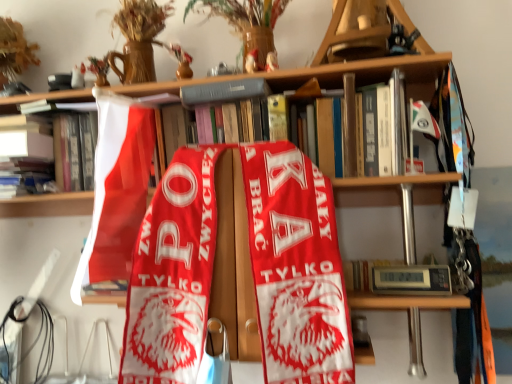
At what (x,y) coordinates should I click in order to perform the action: click on hardcover book at upper center, acting as the 2th book starting from the right. Please return your answer as a coordinate pair (x, y). Looking at the image, I should click on [x=159, y=86].

You are a GUI agent. You are given a task and a screenshot of the screen. Output one action in this format:
    pyautogui.click(x=<x>, y=<y>)
    Task: Click on the hardcover book at upper center, the first book in the right-to-left sequence
    
    Given the screenshot: What is the action you would take?
    pyautogui.click(x=224, y=91)

Identify the location of matte white book at upper left, the third book when ordered from right to left. The width and height of the screenshot is (512, 384). (46, 154).

Between matte white book at upper left, the third book when ordered from right to left, and hardcover book at upper center, acting as the 2th book starting from the right, which one appears on the right side from the viewer's perspective?

hardcover book at upper center, acting as the 2th book starting from the right.

From the image's perspective, is matte white book at upper left, the third book when ordered from right to left, located beneath hardcover book at upper center, which is the second book from left to right?

Yes, from the image's perspective, matte white book at upper left, the third book when ordered from right to left, is beneath hardcover book at upper center, which is the second book from left to right.

Who is bigger, matte white book at upper left, which appears as the 1th book when viewed from the left, or hardcover book at upper center, which is the second book from left to right?

hardcover book at upper center, which is the second book from left to right, is bigger.

Which is in front, matte white book at upper left, the third book when ordered from right to left, or hardcover book at upper center, acting as the 2th book starting from the right?

hardcover book at upper center, acting as the 2th book starting from the right.

Is hardcover book at upper center, acting as the 2th book starting from the right, surrounding red fabric scarf at center?

No, hardcover book at upper center, acting as the 2th book starting from the right, does not contain red fabric scarf at center.

Is hardcover book at upper center, acting as the 2th book starting from the right, facing away from red fabric scarf at center?

No, hardcover book at upper center, acting as the 2th book starting from the right, is not facing the opposite direction of red fabric scarf at center.

Which object is thinner, hardcover book at upper center, acting as the 2th book starting from the right, or red fabric scarf at center?

red fabric scarf at center is thinner.

Is point (87, 91) behind point (335, 339)?

That is True.

From a real-world perspective, which object rests below the other?

red fabric scarf at center.

Considering the positions of objects red fabric scarf at center and matte white book at upper left, the third book when ordered from right to left, in the image provided, who is more to the right, red fabric scarf at center or matte white book at upper left, the third book when ordered from right to left,?

red fabric scarf at center.

Locate an element on the screen. the 3rd book counting from the left side of the red fabric scarf at center is located at coordinates (46, 154).

From the image's perspective, who appears lower, matte white book at upper left, the third book when ordered from right to left, or hardcover book at upper center, the first book in the right-to-left sequence?

matte white book at upper left, the third book when ordered from right to left, from the image's perspective.

Is matte white book at upper left, which appears as the 1th book when viewed from the left, far from hardcover book at upper center, acting as the third book starting from the left?

No, matte white book at upper left, which appears as the 1th book when viewed from the left, is not far away from hardcover book at upper center, acting as the third book starting from the left.

Between matte white book at upper left, the third book when ordered from right to left, and hardcover book at upper center, acting as the third book starting from the left, which one has larger size?

matte white book at upper left, the third book when ordered from right to left, is bigger.

In the scene shown: From a real-world perspective, is matte white book at upper left, which appears as the 1th book when viewed from the left, located higher than hardcover book at upper center, acting as the third book starting from the left?

No, from a real-world perspective, matte white book at upper left, which appears as the 1th book when viewed from the left, is not on top of hardcover book at upper center, acting as the third book starting from the left.

From the picture: From a real-world perspective, is red fabric scarf at center above or below hardcover book at upper center, acting as the third book starting from the left?

From a real-world perspective, red fabric scarf at center is physically below hardcover book at upper center, acting as the third book starting from the left.

Between point (165, 316) and point (197, 97), which one is positioned in front?

The point (165, 316) is closer to the camera.

From the image's perspective, does red fabric scarf at center appear higher than hardcover book at upper center, acting as the third book starting from the left?

Incorrect, from the image's perspective, red fabric scarf at center is lower than hardcover book at upper center, acting as the third book starting from the left.

Is red fabric scarf at center far away from hardcover book at upper center, the first book in the right-to-left sequence?

No, red fabric scarf at center is not far away from hardcover book at upper center, the first book in the right-to-left sequence.

Is hardcover book at upper center, which is the second book from left to right, bigger than hardcover book at upper center, acting as the third book starting from the left?

Yes, hardcover book at upper center, which is the second book from left to right, is bigger than hardcover book at upper center, acting as the third book starting from the left.

From the picture: Can you confirm if hardcover book at upper center, acting as the 2th book starting from the right, is taller than hardcover book at upper center, acting as the third book starting from the left?

Correct, hardcover book at upper center, acting as the 2th book starting from the right, is much taller as hardcover book at upper center, acting as the third book starting from the left.

Between hardcover book at upper center, acting as the 2th book starting from the right, and hardcover book at upper center, acting as the third book starting from the left, which one appears on the left side from the viewer's perspective?

From the viewer's perspective, hardcover book at upper center, acting as the 2th book starting from the right, appears more on the left side.

Looking at this image, from a real-world perspective, between hardcover book at upper center, which is the second book from left to right, and hardcover book at upper center, acting as the third book starting from the left, who is vertically lower?

In real-world perspective, hardcover book at upper center, which is the second book from left to right, is lower.

Is hardcover book at upper center, the first book in the right-to-left sequence, turned away from hardcover book at upper center, acting as the 2th book starting from the right?

Yes, hardcover book at upper center, the first book in the right-to-left sequence, is positioned with its back facing hardcover book at upper center, acting as the 2th book starting from the right.

Looking at the image, does hardcover book at upper center, acting as the third book starting from the left, seem bigger or smaller compared to hardcover book at upper center, acting as the 2th book starting from the right?

hardcover book at upper center, acting as the third book starting from the left, is smaller than hardcover book at upper center, acting as the 2th book starting from the right.

Is hardcover book at upper center, acting as the third book starting from the left, to the left or to the right of hardcover book at upper center, which is the second book from left to right, in the image?

hardcover book at upper center, acting as the third book starting from the left, is positioned on hardcover book at upper center, which is the second book from left to right,'s right side.

Would you consider hardcover book at upper center, the first book in the right-to-left sequence, to be distant from hardcover book at upper center, acting as the 2th book starting from the right?

That's not correct — hardcover book at upper center, the first book in the right-to-left sequence, is a little close to hardcover book at upper center, acting as the 2th book starting from the right.

The image size is (512, 384). Identify the location of the 1st book counting from the right of the matte white book at upper left, which appears as the 1th book when viewed from the left. (159, 86).

Image resolution: width=512 pixels, height=384 pixels. In the image, there is a hardcover book at upper center, which is the second book from left to right. Find the location of `beach towel below it (from a real-world perspective)`. beach towel below it (from a real-world perspective) is located at coordinates (239, 271).

Based on their spatial positions, is hardcover book at upper center, the first book in the right-to-left sequence, or matte white book at upper left, which appears as the 1th book when viewed from the left, further from red fabric scarf at center?

matte white book at upper left, which appears as the 1th book when viewed from the left, is positioned further to the anchor red fabric scarf at center.

Estimate the real-world distances between objects in this image. Which object is closer to matte white book at upper left, the third book when ordered from right to left, hardcover book at upper center, acting as the 2th book starting from the right, or hardcover book at upper center, the first book in the right-to-left sequence?

The object closer to matte white book at upper left, the third book when ordered from right to left, is hardcover book at upper center, acting as the 2th book starting from the right.

Based on their spatial positions, is hardcover book at upper center, acting as the third book starting from the left, or hardcover book at upper center, which is the second book from left to right, closer to red fabric scarf at center?

Based on the image, hardcover book at upper center, which is the second book from left to right, appears to be nearer to red fabric scarf at center.

From the image, which object appears to be nearer to matte white book at upper left, the third book when ordered from right to left, hardcover book at upper center, acting as the third book starting from the left, or hardcover book at upper center, which is the second book from left to right?

The object closer to matte white book at upper left, the third book when ordered from right to left, is hardcover book at upper center, which is the second book from left to right.

Based on the photo, considering their positions, is hardcover book at upper center, acting as the 2th book starting from the right, positioned further to red fabric scarf at center than hardcover book at upper center, acting as the third book starting from the left?

Among the two, hardcover book at upper center, acting as the third book starting from the left, is located further to red fabric scarf at center.

When comparing their distances from matte white book at upper left, which appears as the 1th book when viewed from the left, does hardcover book at upper center, acting as the 2th book starting from the right, or red fabric scarf at center seem closer?

hardcover book at upper center, acting as the 2th book starting from the right, lies closer to matte white book at upper left, which appears as the 1th book when viewed from the left, than the other object.

Estimate the real-world distances between objects in this image. Which object is closer to hardcover book at upper center, the first book in the right-to-left sequence, matte white book at upper left, the third book when ordered from right to left, or hardcover book at upper center, acting as the 2th book starting from the right?

hardcover book at upper center, acting as the 2th book starting from the right.

Based on their spatial positions, is hardcover book at upper center, acting as the third book starting from the left, or red fabric scarf at center further from hardcover book at upper center, which is the second book from left to right?

red fabric scarf at center.

Where is `book between matte white book at upper left, which appears as the 1th book when viewed from the left, and hardcover book at upper center, the first book in the right-to-left sequence`? The height and width of the screenshot is (384, 512). book between matte white book at upper left, which appears as the 1th book when viewed from the left, and hardcover book at upper center, the first book in the right-to-left sequence is located at coordinates (159, 86).